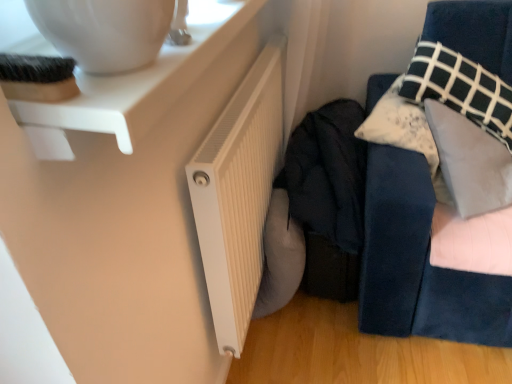
Where is `white plastic table at upper left`? white plastic table at upper left is located at coordinates (136, 86).

Measure the distance between point (288,209) and camera.

The distance of point (288,209) from camera is 4.42 feet.

The image size is (512, 384). What do you see at coordinates (238, 194) in the screenshot?
I see `white ribbed radiator at lower center` at bounding box center [238, 194].

What is the approximate height of velvet blue sofa at right?

velvet blue sofa at right is 22.39 inches in height.

The height and width of the screenshot is (384, 512). In order to click on white plastic table at upper left in this screenshot , I will do `click(136, 86)`.

Is the position of white plastic table at upper left less distant than that of velvet blue sofa at right?

Yes, it is.

Considering the sizes of objects white plastic table at upper left and velvet blue sofa at right in the image provided, who is thinner, white plastic table at upper left or velvet blue sofa at right?

Thinner between the two is white plastic table at upper left.

Can you see white plastic table at upper left touching velvet blue sofa at right?

No, white plastic table at upper left is not next to velvet blue sofa at right.

Is white plastic table at upper left facing towards velvet blue sofa at right?

No.

Is white ribbed radiator at lower center placed right next to white plastic table at upper left?

No.

Can you tell me how much white ribbed radiator at lower center and white plastic table at upper left differ in facing direction?

There is a 1.25-degree angle between the facing directions of white ribbed radiator at lower center and white plastic table at upper left.

Locate an element on the screen. The height and width of the screenshot is (384, 512). radiator below the white plastic table at upper left (from the image's perspective) is located at coordinates (238, 194).

Which of these two, white ribbed radiator at lower center or white plastic table at upper left, is thinner?

Thinner between the two is white ribbed radiator at lower center.

Does velvet blue sofa at right have a greater height compared to white ribbed radiator at lower center?

In fact, velvet blue sofa at right may be shorter than white ribbed radiator at lower center.

Could you tell me if velvet blue sofa at right is turned towards white ribbed radiator at lower center?

No, velvet blue sofa at right is not aimed at white ribbed radiator at lower center.

Considering the positions of objects velvet blue sofa at right and white ribbed radiator at lower center in the image provided, who is behind, velvet blue sofa at right or white ribbed radiator at lower center?

velvet blue sofa at right is further away from the camera.

Would you say velvet blue sofa at right is inside or outside white ribbed radiator at lower center?

velvet blue sofa at right is located beyond the bounds of white ribbed radiator at lower center.

Considering the relative positions of white plastic table at upper left and white ribbed radiator at lower center in the image provided, is white plastic table at upper left to the right of white ribbed radiator at lower center from the viewer's perspective?

In fact, white plastic table at upper left is to the left of white ribbed radiator at lower center.

Which is nearer, (x=175, y=56) or (x=246, y=315)?

Positioned in front is point (x=175, y=56).

From a real-world perspective, is white plastic table at upper left physically below white ribbed radiator at lower center?

Actually, white plastic table at upper left is physically above white ribbed radiator at lower center in the real world.

Is dark fabric jacket at center facing away from velvet blue sofa at right?

No, dark fabric jacket at center is not facing the opposite direction of velvet blue sofa at right.

Who is more distant, dark fabric jacket at center or velvet blue sofa at right?

dark fabric jacket at center is more distant.

Who is smaller, dark fabric jacket at center or velvet blue sofa at right?

velvet blue sofa at right.

Can you tell me how much velvet blue sofa at right and white plastic table at upper left differ in facing direction?

velvet blue sofa at right and white plastic table at upper left are facing 66.3 degrees away from each other.

Locate an element on the screen. table that appears on the left of velvet blue sofa at right is located at coordinates (136, 86).

From a real-world perspective, does velvet blue sofa at right stand above white plastic table at upper left?

No, from a real-world perspective, velvet blue sofa at right is not above white plastic table at upper left.

Are velvet blue sofa at right and white plastic table at upper left far apart?

velvet blue sofa at right is actually quite close to white plastic table at upper left.

Is dark fabric jacket at center not near white ribbed radiator at lower center?

Actually, dark fabric jacket at center and white ribbed radiator at lower center are a little close together.

Looking at this image, considering the sizes of dark fabric jacket at center and white ribbed radiator at lower center in the image, is dark fabric jacket at center wider or thinner than white ribbed radiator at lower center?

In the image, dark fabric jacket at center appears to be wider than white ribbed radiator at lower center.

This screenshot has width=512, height=384. Find the location of `radiator on the left of dark fabric jacket at center`. radiator on the left of dark fabric jacket at center is located at coordinates (238, 194).

Locate an element on the screen. Image resolution: width=512 pixels, height=384 pixels. furniture lying on the right of white plastic table at upper left is located at coordinates (420, 264).

You are a GUI agent. You are given a task and a screenshot of the screen. Output one action in this format:
    pyautogui.click(x=<x>, y=<y>)
    Task: Click on the table located on the left of white ribbed radiator at lower center
    This screenshot has height=384, width=512.
    Given the screenshot: What is the action you would take?
    pyautogui.click(x=136, y=86)

From the image, which object appears to be nearer to white plastic table at upper left, white ribbed radiator at lower center or velvet blue sofa at right?

Based on the image, white ribbed radiator at lower center appears to be nearer to white plastic table at upper left.

When comparing their distances from white plastic table at upper left, does dark fabric jacket at center or white ribbed radiator at lower center seem closer?

white ribbed radiator at lower center is closer to white plastic table at upper left.

When comparing their distances from velvet blue sofa at right, does dark fabric jacket at center or white ribbed radiator at lower center seem further?

white ribbed radiator at lower center is further to velvet blue sofa at right.

Consider the image. Based on their spatial positions, is velvet blue sofa at right or dark fabric jacket at center closer to white plastic table at upper left?

dark fabric jacket at center.

Considering their positions, is white plastic table at upper left positioned further to dark fabric jacket at center than velvet blue sofa at right?

white plastic table at upper left.

Considering their positions, is white ribbed radiator at lower center positioned closer to white plastic table at upper left than dark fabric jacket at center?

Based on the image, white ribbed radiator at lower center appears to be nearer to white plastic table at upper left.

Estimate the real-world distances between objects in this image. Which object is further from dark fabric jacket at center, velvet blue sofa at right or white ribbed radiator at lower center?

The object further to dark fabric jacket at center is white ribbed radiator at lower center.

Looking at the image, which one is located closer to white ribbed radiator at lower center, white plastic table at upper left or dark fabric jacket at center?

Among the two, dark fabric jacket at center is located nearer to white ribbed radiator at lower center.

Locate an element on the screen. This screenshot has width=512, height=384. radiator situated between white plastic table at upper left and velvet blue sofa at right from left to right is located at coordinates (238, 194).

Where is `clothing between white ribbed radiator at lower center and velvet blue sofa at right`? clothing between white ribbed radiator at lower center and velvet blue sofa at right is located at coordinates click(x=328, y=174).

At what (x,y) coordinates should I click in order to perform the action: click on radiator located between white plastic table at upper left and dark fabric jacket at center in the depth direction. Please return your answer as a coordinate pair (x, y). This screenshot has width=512, height=384. Looking at the image, I should click on (238, 194).

Locate an element on the screen. The image size is (512, 384). clothing located between white plastic table at upper left and velvet blue sofa at right in the left-right direction is located at coordinates pyautogui.click(x=328, y=174).